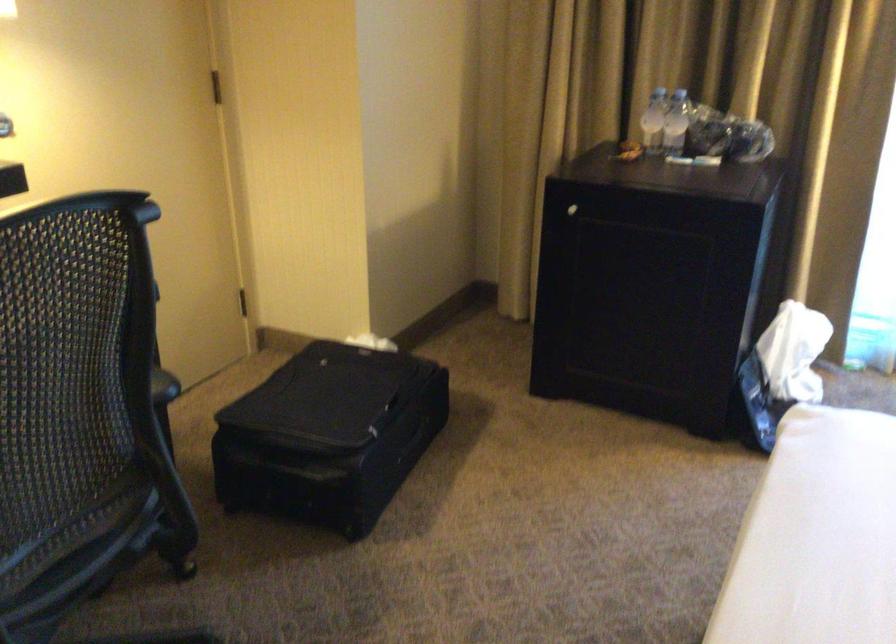
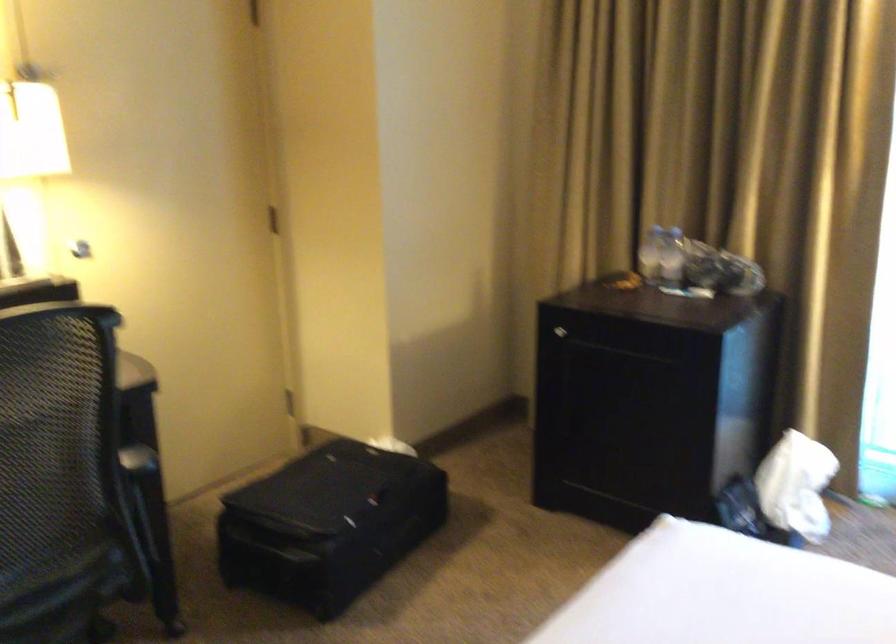
Find the pixel in the second image that matches [650,120] in the first image.

(650, 252)